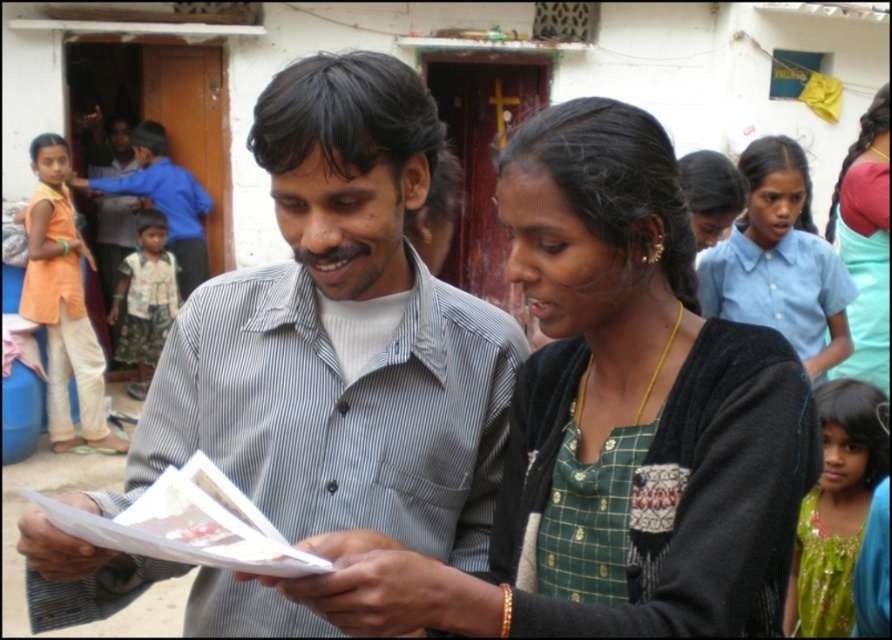
You are a photographer trying to capture a candid shot of the striped cotton shirt at center and the green woven apron at lower right. Since you want both subjects in the frame, can you position yourself so that both are visible without moving the subjects?

Yes, the striped cotton shirt at center is to the left of the green woven apron at lower right, so positioning yourself to the left of the striped cotton shirt at center or to the right of the green woven apron at lower right would allow both to be visible in the frame.

You are a photographer trying to capture the two points of interest in the scene. The first point is at coordinates point [32,257] and the second is at point [824,545]. Based on their positions, which point is closer to your camera lens?

Point [32,257] is closer to the camera lens than point [824,545] because it is further to the camera than the other point according to the description.